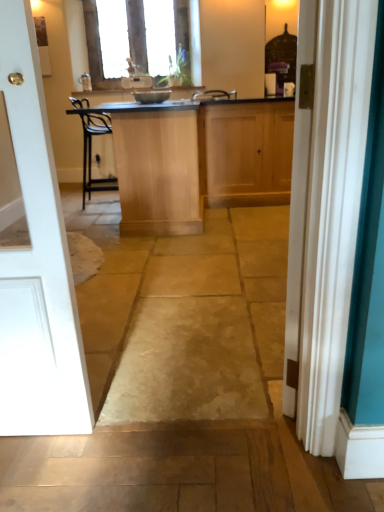
Question: From the image's perspective, is metallic silver bowl at center located above or below white painted wood door at left?

Choices:
 (A) below
 (B) above

Answer: (B)

Question: Relative to white painted wood door at left, is metallic silver bowl at center in front or behind?

Choices:
 (A) behind
 (B) front

Answer: (A)

Question: Which object is the farthest from the wooden cabinet at center, which is counted as the 1th cabinetry, starting from the right?

Choices:
 (A) natural stone floor at center
 (B) clear glass window at upper center
 (C) metallic silver bowl at center
 (D) light wood/finely finished cabinet at center, the first cabinetry from the left
 (E) teal fabric curtain at right

Answer: (E)

Question: Considering the real-world distances, which object is farthest from the white painted wood door at left?

Choices:
 (A) wooden cabinet at center, marked as the 2th cabinetry in a left-to-right arrangement
 (B) natural stone floor at center
 (C) light wood/finely finished cabinet at center, placed as the second cabinetry when sorted from right to left
 (D) clear glass window at upper center
 (E) teal fabric curtain at right

Answer: (D)